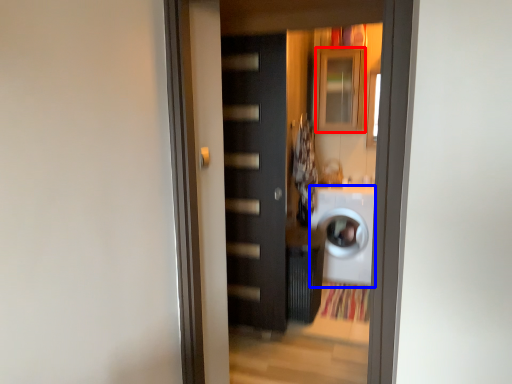
Question: Which point is further to the camera, cabinetry (highlighted by a red box) or washing machine (highlighted by a blue box)?

Choices:
 (A) cabinetry
 (B) washing machine

Answer: (A)